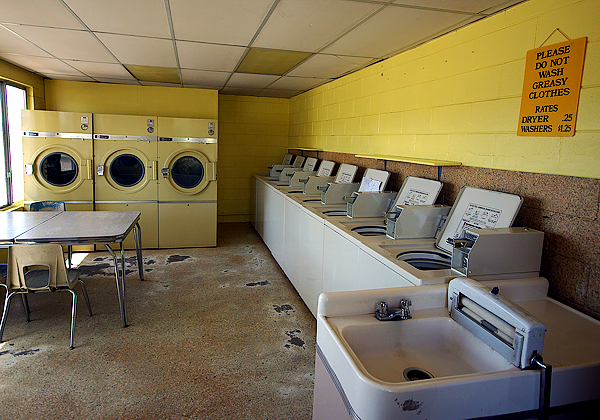
This screenshot has width=600, height=420. What are the coordinates of `window` in the screenshot? It's located at (124, 166).